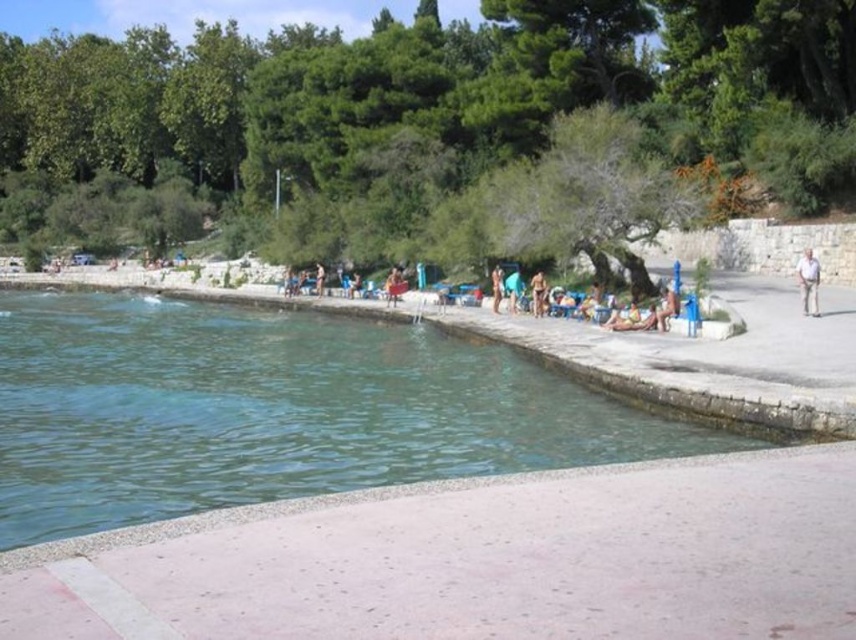
You are standing on the walkway and want to retrieve your blue fabric towel at center. There is a tan skin person at center blocking your path. Can you walk directly to the towel without moving around the person?

The tan skin person at center is closer to the viewer than the blue fabric towel at center, so you would need to walk around them to reach the towel.

You are standing on the walkway and want to jump into the water. The clear concrete pool at center is a shallow area, and the white cotton shirt at right is a deeper section. Which location would you choose to jump into to avoid hitting the bottom?

You should jump into the clear concrete pool at center because it is wider than the white cotton shirt at right, indicating it might be deeper and safer to avoid hitting the bottom.